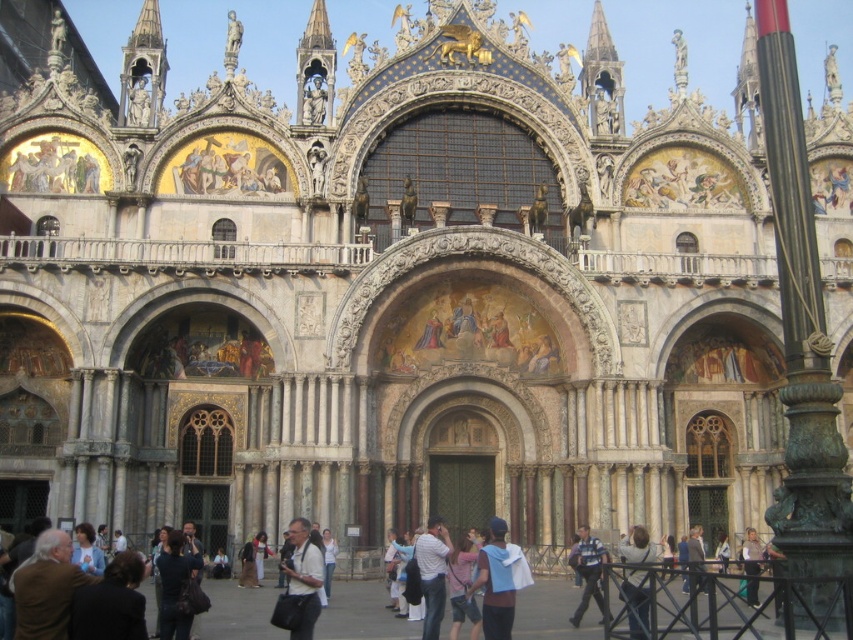
You are a tourist standing in front of St. Mark Basilica and you see a light blue fabric jacket at center and a light blue denim jacket at lower right. Which one is closer to the ground?

The light blue fabric jacket at center is located below light blue denim jacket at lower right, so the light blue fabric jacket at center is closer to the ground.

You are a tour guide at St. Mark Basilica. You notice two jackets left behind by tourists. One is the light blue fabric jacket at center and the other is the light blue denim jacket at lower right. Which jacket is taller?

The light blue fabric jacket at center is taller than the light blue denim jacket at lower right.

Based on the photo, you are standing in front of St. Mark Basilica and see a light blue denim jacket at lower right. Where is the light blue denim jacket located relative to the basilica?

The light blue denim jacket at lower right is located at point (637, 604) relative to the basilica.